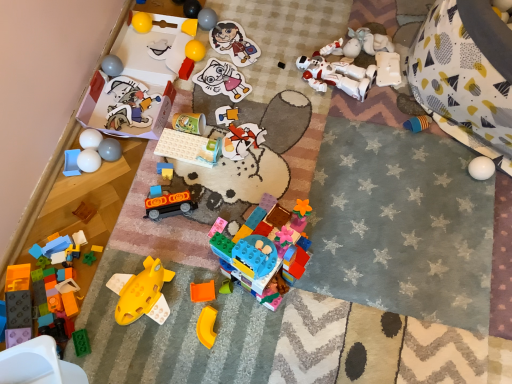
Locate an element on the screen. This screenshot has width=512, height=384. unoccupied region to the right of matte plastic blocks at center, which appears as the fifteenth toy when viewed from the right is located at coordinates (215, 172).